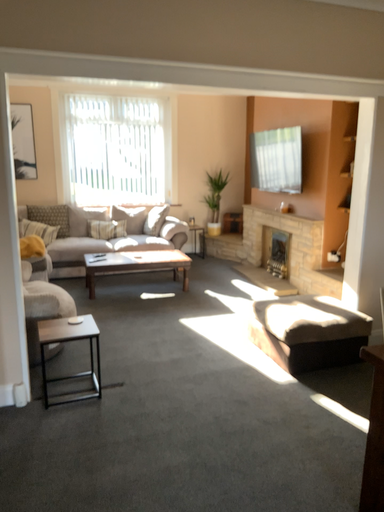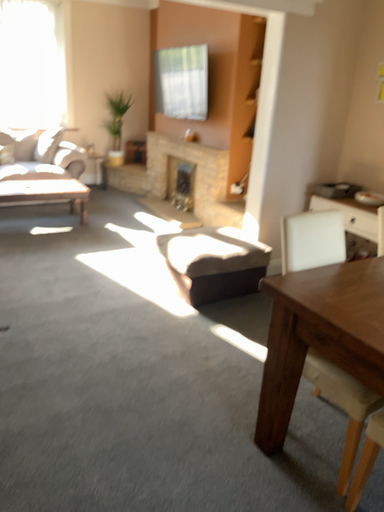
Question: Which way did the camera rotate in the video?

Choices:
 (A) rotated downward
 (B) rotated upward

Answer: (A)